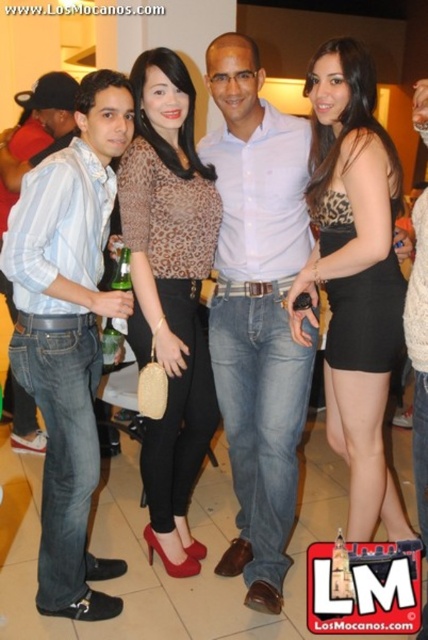
You are a photographer at a social event. You want to take a photo of the matte blue jeans at left and leopard print top at center. How far apart are these two items in the image?

The matte blue jeans at left is 34.26 inches away from the leopard print top at center.

You are standing in the image and want to reach both the point at location (246, 403) and the point at (360, 397). Which point will you reach first?

You will reach the point at (246, 403) first because it is closer to you than the point at (360, 397), which is further away.